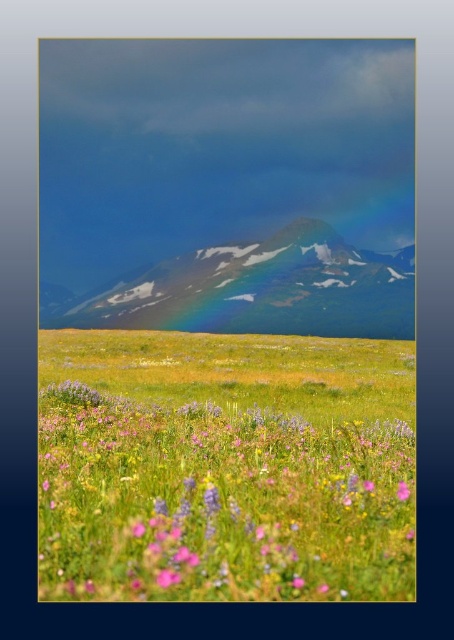
You are a botanist examining the meadow and want to compare the two flowers. Which flower has a bigger size between the soft pink petals at center and the pink matte flower at lower right?

The soft pink petals at center has a larger size compared to the pink matte flower at lower right.

You are an artist planning to paint the scene. You need to decide whether the sleek glassy mountain at center will fit entirely within a canvas that can only accommodate objects narrower than the pink matte flower at lower right. Can it fit?

The sleek glassy mountain at center might be wider than pink matte flower at lower right, so it may not fit entirely on the canvas if the canvas can only accommodate objects narrower than the pink matte flower at lower right.

You are a botanist studying the flowers in the meadow. You notice two specific flowers, the soft pink petals at center and the pink matte flower at lower right. Which flower is taller?

The soft pink petals at center is taller than the pink matte flower at lower right.